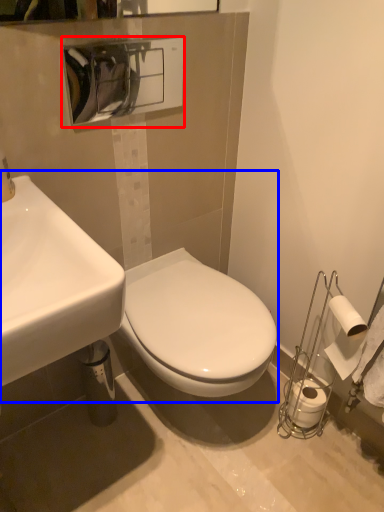
Question: Which object appears closest to the camera in this image, hand dryer (highlighted by a red box) or sink (highlighted by a blue box)?

Choices:
 (A) hand dryer
 (B) sink

Answer: (B)